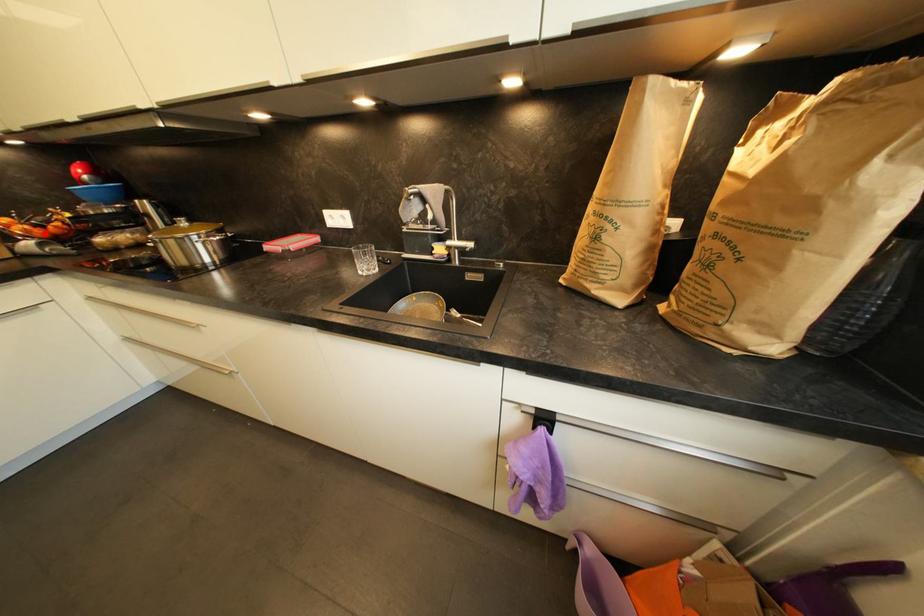
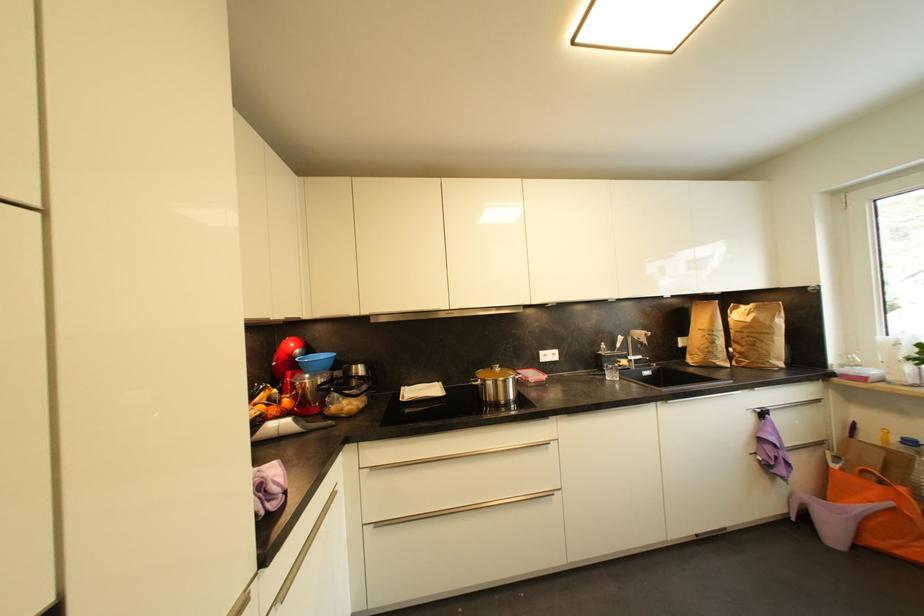
Locate, in the second image, the point that corresponds to the highlighted location in the first image.

(277, 411)